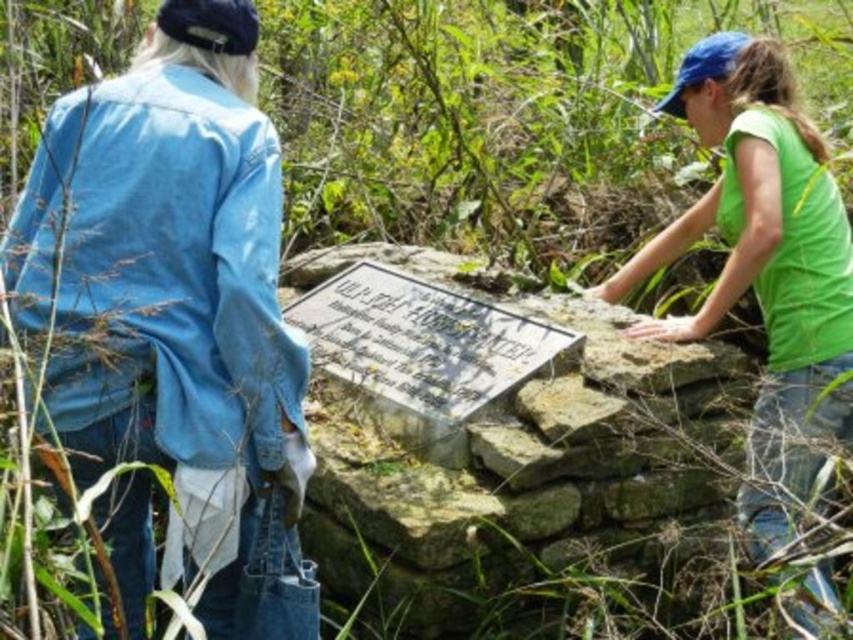
You are a photographer trying to capture a photo of the metal plaque on the stone structure. You need to ensure that both the denim jacket at upper left and the green matte shirt at upper right are visible in the frame. Which person should you position closer to the plaque to include both in the shot?

The denim jacket at upper left is positioned over the green matte shirt at upper right. To include both in the frame, you should position the person in the green matte shirt at upper right closer to the plaque since they are behind the denim jacket at upper left.